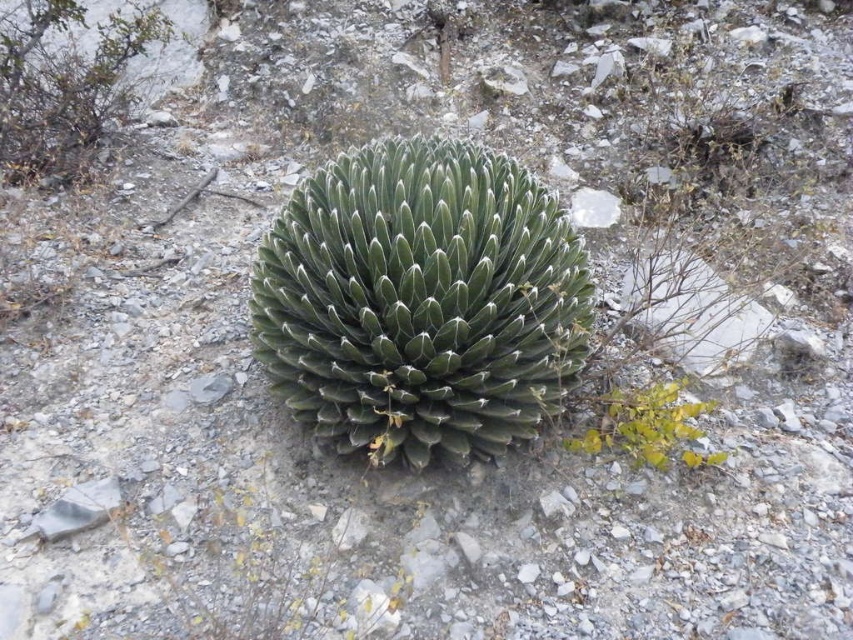
Question: Is green spiky cactus at upper left below green leafy plant at lower right?

Choices:
 (A) no
 (B) yes

Answer: (A)

Question: Which of the following is the farthest from the observer?

Choices:
 (A) (625, 435)
 (B) (42, 168)

Answer: (B)

Question: Can you confirm if green spiky cactus at upper left is thinner than green leafy plant at lower right?

Choices:
 (A) yes
 (B) no

Answer: (B)

Question: Is green spiky cactus at upper left positioned behind green leafy plant at lower right?

Choices:
 (A) yes
 (B) no

Answer: (A)

Question: Which point is farther to the camera?

Choices:
 (A) (596, 404)
 (B) (25, 68)

Answer: (B)